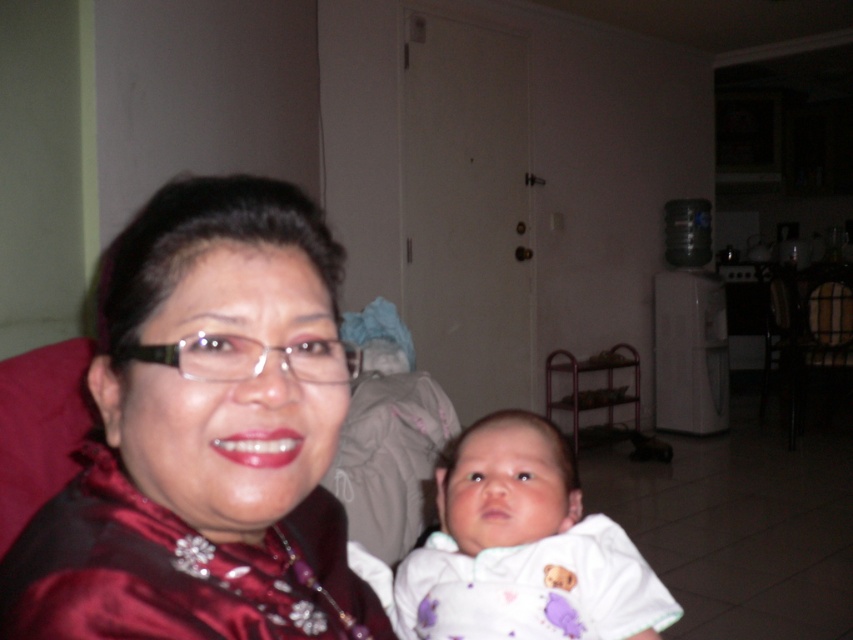
Does satin red blouse at left have a larger size compared to white soft fabric baby at center?

Correct, satin red blouse at left is larger in size than white soft fabric baby at center.

Is point (312, 262) positioned in front of point (556, 440)?

That is True.

At what (x,y) coordinates should I click in order to perform the action: click on satin red blouse at left. Please return your answer as a coordinate pair (x, y). The width and height of the screenshot is (853, 640). Looking at the image, I should click on pos(206,436).